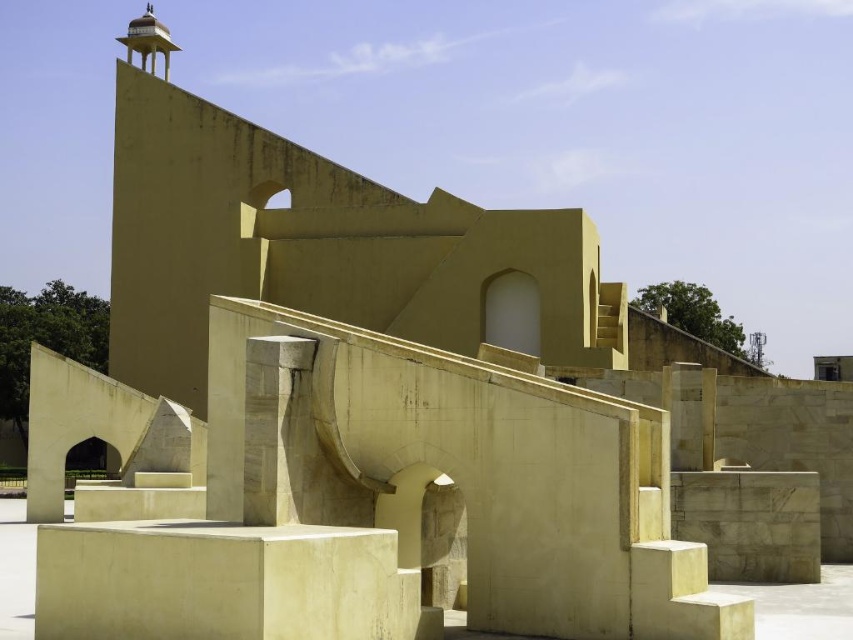
Image resolution: width=853 pixels, height=640 pixels. What do you see at coordinates (221, 582) in the screenshot? I see `beige stone cube at center` at bounding box center [221, 582].

Between beige stone cube at center and gray concrete wall at center, which one appears on the right side from the viewer's perspective?

gray concrete wall at center is more to the right.

Who is more distant from viewer, (x=61, y=566) or (x=732, y=484)?

The point (x=732, y=484) is more distant.

At what (x,y) coordinates should I click in order to perform the action: click on beige stone cube at center. Please return your answer as a coordinate pair (x, y). Looking at the image, I should click on pos(221,582).

Is white marble pillar at center above beige stone stairs at lower right?

Correct, white marble pillar at center is located above beige stone stairs at lower right.

Who is more forward, (267, 355) or (697, 577)?

Point (697, 577) is more forward.

Is point (276, 384) closer to camera compared to point (749, 602)?

No.

Where is `white marble pillar at center`? white marble pillar at center is located at coordinates (273, 424).

Does gray concrete wall at center have a larger size compared to beige stone stairs at lower right?

Yes, gray concrete wall at center is bigger than beige stone stairs at lower right.

This screenshot has height=640, width=853. I want to click on gray concrete wall at center, so click(x=750, y=522).

Image resolution: width=853 pixels, height=640 pixels. I want to click on gray concrete wall at center, so click(x=750, y=522).